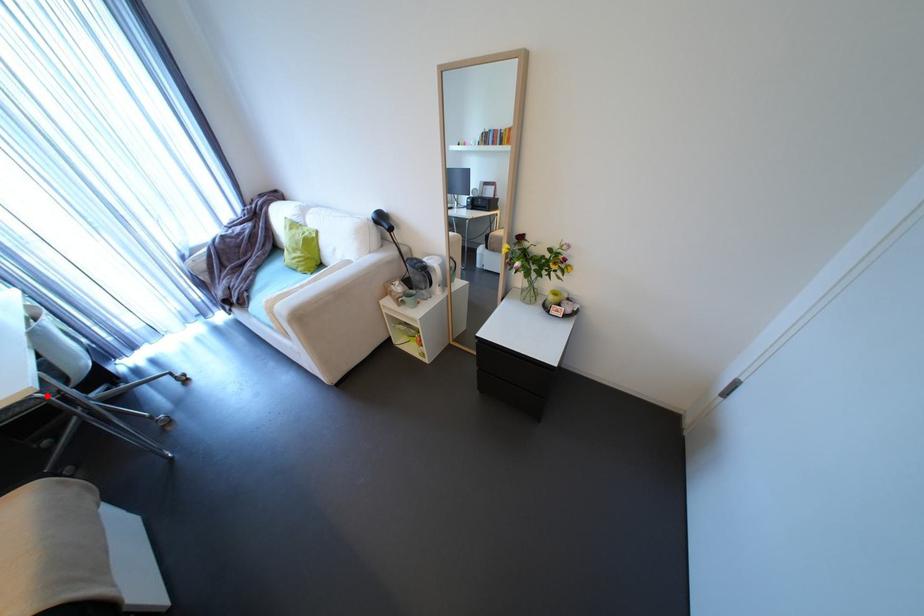
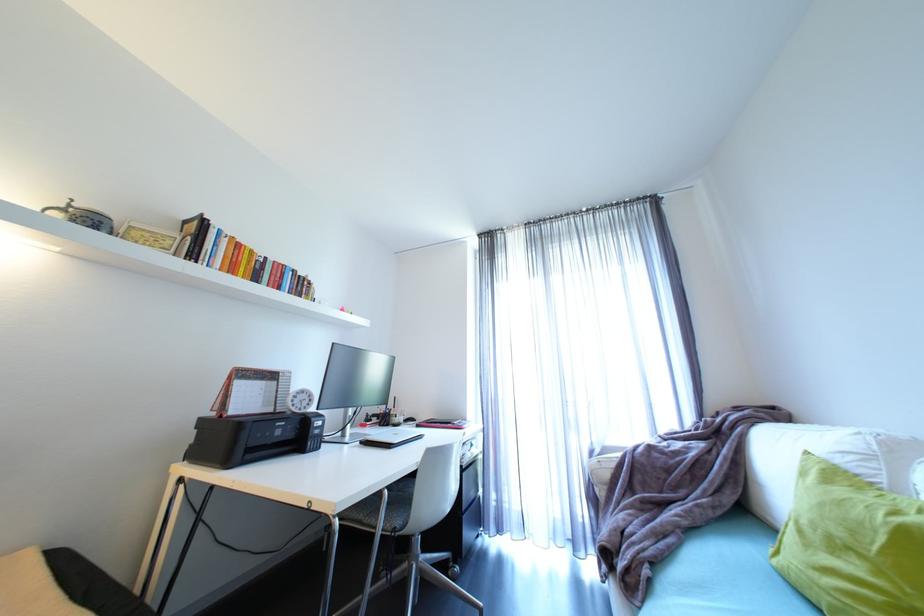
In the second image, find the point that corresponds to the highlighted location in the first image.

(344, 522)